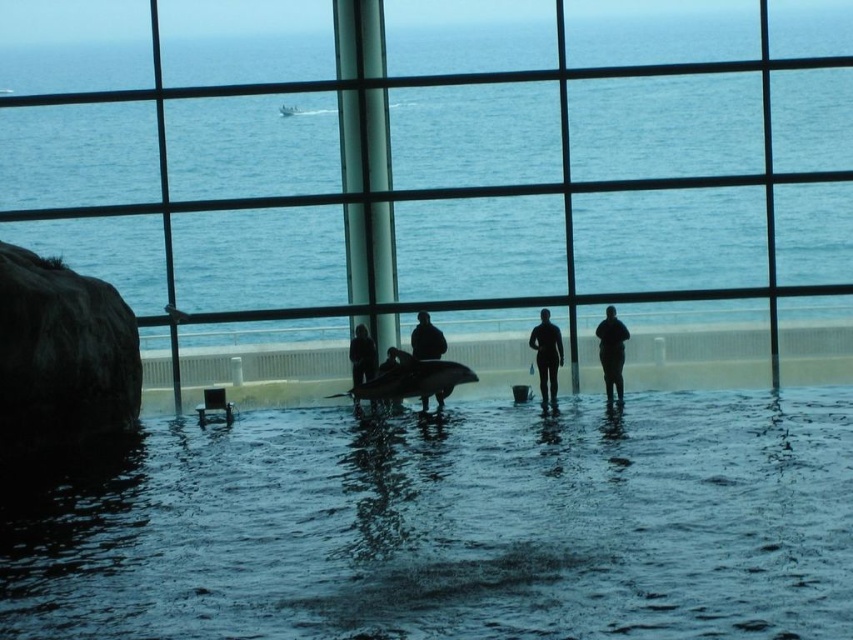
Is smooth dark skin at center further to camera compared to dark matte wetsuit at center?

Yes, smooth dark skin at center is behind dark matte wetsuit at center.

Can you confirm if smooth dark skin at center is positioned above dark matte wetsuit at center?

Yes, smooth dark skin at center is above dark matte wetsuit at center.

At what (x,y) coordinates should I click in order to perform the action: click on smooth dark skin at center. Please return your answer as a coordinate pair (x, y). Looking at the image, I should click on (426, 339).

The width and height of the screenshot is (853, 640). In order to click on smooth dark skin at center in this screenshot , I will do `click(426, 339)`.

The image size is (853, 640). What do you see at coordinates (440, 188) in the screenshot? I see `transparent glass window at center` at bounding box center [440, 188].

Does transparent glass window at center have a lesser width compared to matte black dolphin at center?

No.

Does point (352, 195) come farther from viewer compared to point (408, 365)?

Yes, point (352, 195) is behind point (408, 365).

Locate an element on the screen. transparent glass window at center is located at coordinates (440, 188).

Does matte black dolphin at center have a greater height compared to silhouette wetsuit at center?

In fact, matte black dolphin at center may be shorter than silhouette wetsuit at center.

Does point (440, 387) lie behind point (553, 401)?

No, (440, 387) is in front of (553, 401).

This screenshot has width=853, height=640. Identify the location of matte black dolphin at center. (410, 380).